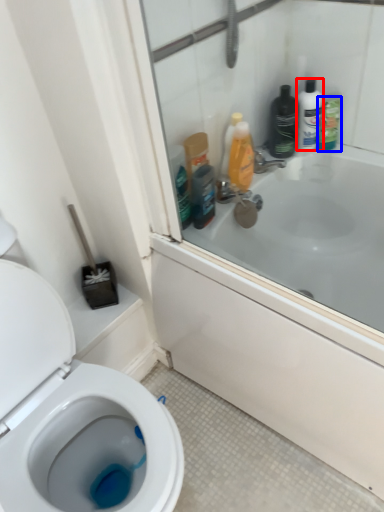
Question: Which of the following is the closest to the observer, toiletry (highlighted by a red box) or cleaning product (highlighted by a blue box)?

Choices:
 (A) toiletry
 (B) cleaning product

Answer: (A)